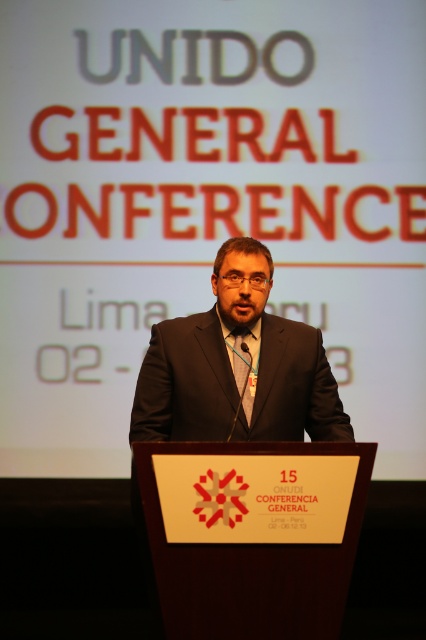
Between dark gray suit at center and matte black tie at center, which one has less height?

matte black tie at center

Does dark gray suit at center appear over matte black tie at center?

Yes.

Between point (160, 374) and point (247, 380), which one is positioned in front?

Positioned in front is point (160, 374).

This screenshot has width=426, height=640. Find the location of `dark gray suit at center`. dark gray suit at center is located at coordinates (236, 365).